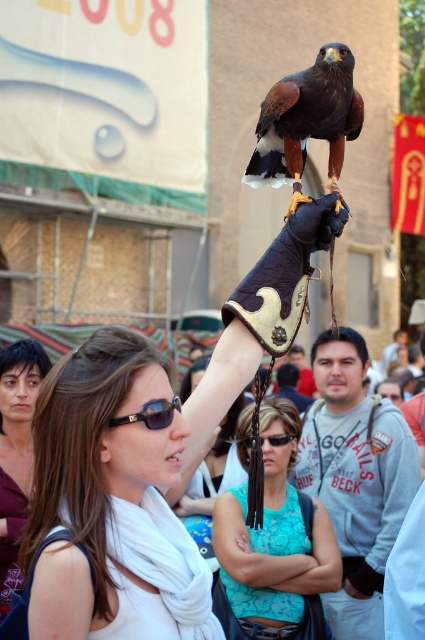
You are a photographer trying to capture the perfect shot of the brown feathered falcon at center. To ensure the falcon is in the center of your photo, where should you position your camera? Please provide coordinates in the format of a point like this example format, e.g., point is at point 0.189, 0.720. The scene is from the photographer standing at the origin point.

The brown feathered falcon at center is located at point (306, 120), so you should position your camera to aim directly at that coordinate to center the falcon in your photo.

You are a photographer trying to capture the hawk and the person holding it. You notice the white fabric scarf at center and the black leather goggles at upper center. Which object should you focus on first if you want to take a clear photo of the one closer to you?

The white fabric scarf at center is closer to the viewer than the black leather goggles at upper center, so you should focus on the white fabric scarf at center first for a clear photo.

You are a photographer trying to capture a clear shot of the person holding the hawk. You notice two items on their head at the upper center area. Which item is closer to the camera, the black plastic sunglasses at upper center or the black leather goggles at upper center?

The black plastic sunglasses at upper center is closer to the camera because they are positioned in front of the black leather goggles at upper center, which are further back.